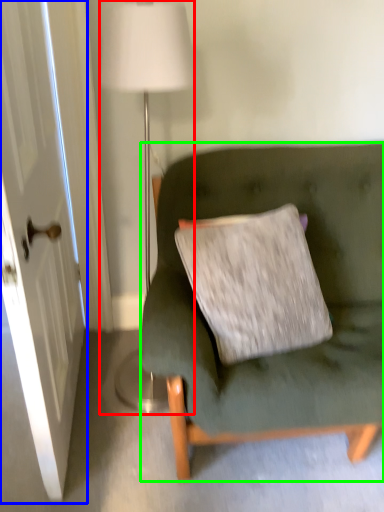
Question: Estimate the real-world distances between objects in this image. Which object is closer to lamp (highlighted by a red box), door (highlighted by a blue box) or studio couch (highlighted by a green box)?

Choices:
 (A) door
 (B) studio couch

Answer: (A)